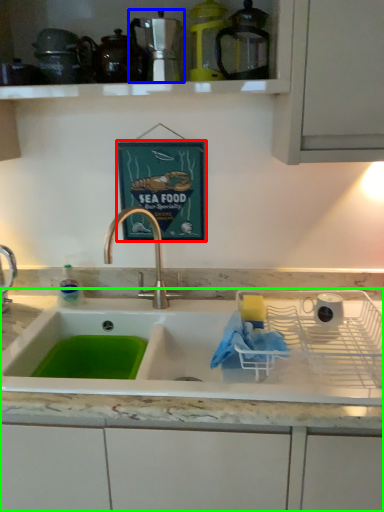
Question: Considering the real-world distances, which object is closest to picture frame (highlighted by a red box)? appliance (highlighted by a blue box) or countertop (highlighted by a green box).

Choices:
 (A) appliance
 (B) countertop

Answer: (A)